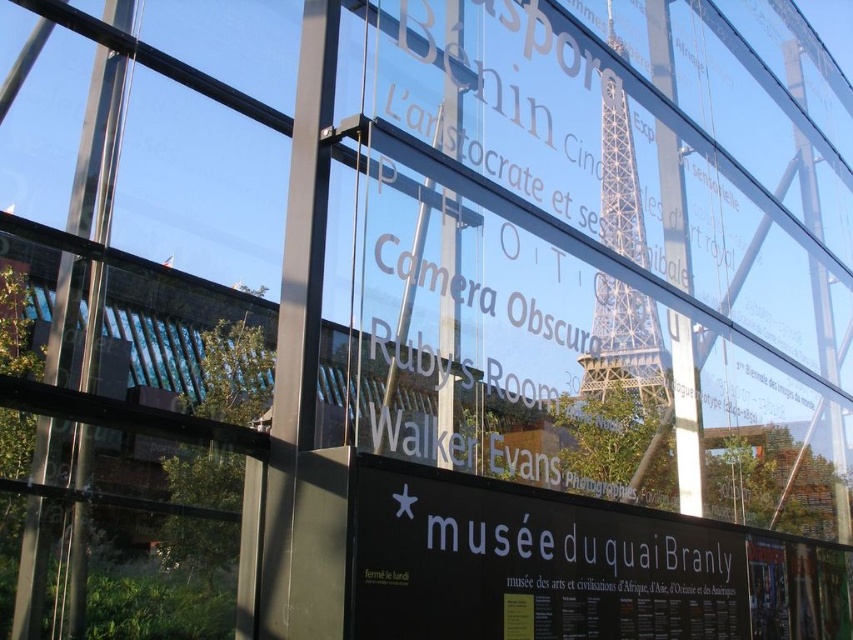
You are a tourist holding a map and looking at the black matte sign at center and the metallic silver eiffel tower at center. According to the map, you need to walk towards the object that is higher in the image. Which one should you walk towards?

The black matte sign at center is located below the metallic silver eiffel tower at center, so the metallic silver eiffel tower at center is higher in the image. Therefore, you should walk towards the metallic silver eiffel tower at center.

You are a tour guide leading a group to the entrance of the museum. The entrance is located 25 meters away from the metallic silver eiffel tower at center. Can you walk directly from the black matte sign at center to the entrance without needing to move around any obstacles?

The distance between the black matte sign at center and the metallic silver eiffel tower at center is 23.60 meters. Since the entrance is 25 meters away from the tower, the sign is closer to the entrance by approximately 1.4 meters. Therefore, you can walk directly from the black matte sign at center to the entrance without needing to move around obstacles as the path is clear.

You are a tourist in Paris holding a camera. You want to take a photo of the metallic silver eiffel tower at center but also want to include the black matte sign at center in the frame. Given their sizes, will you need to zoom out or zoom in to capture both?

The black matte sign at center is smaller than the metallic silver eiffel tower at center. To include both in the frame, you need to zoom out so that both the smaller sign and the larger Eiffel Tower fit into the photo.